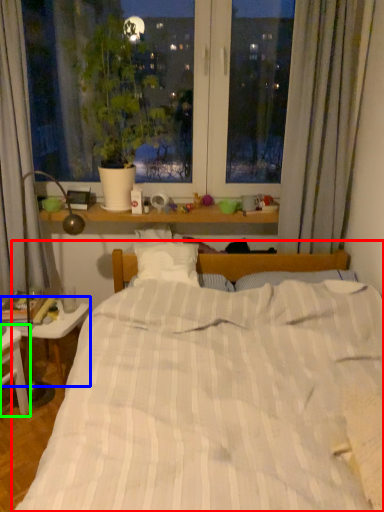
Question: Estimate the real-world distances between objects in this image. Which object is closer to bed (highlighted by a red box), table (highlighted by a blue box) or nightstand (highlighted by a green box)?

Choices:
 (A) table
 (B) nightstand

Answer: (B)